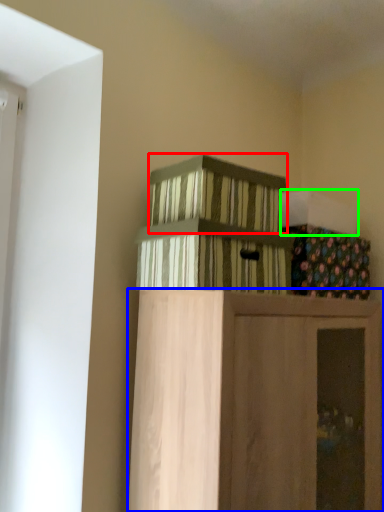
Question: Which object is positioned closest to crate (highlighted by a red box)? Select from furniture (highlighted by a blue box) and box (highlighted by a green box).

Choices:
 (A) furniture
 (B) box

Answer: (B)